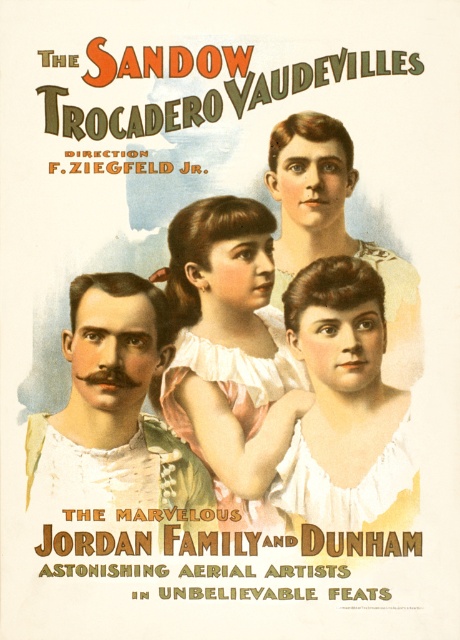
Looking at the vintage poster for The Sandow Trocadero Vaudevilles, you notice a mustached man at center and a matte white blouse at upper center. Which object takes up more space in the image?

The mustached man at center is bigger than the matte white blouse at upper center, so the mustached man at center takes up more space in the image.